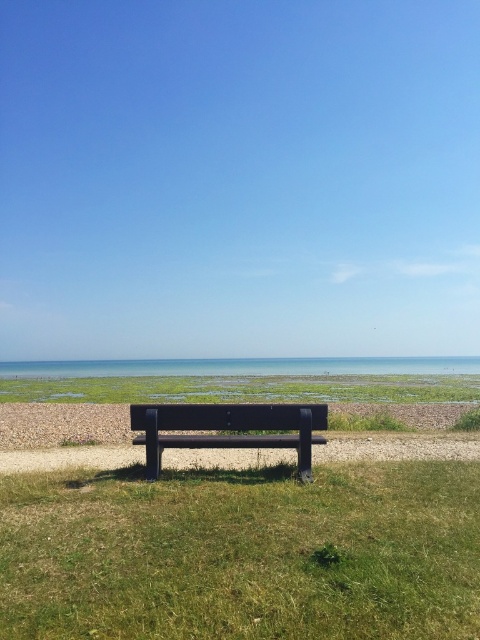
Which of these two, green grass at center or blue water at center, stands shorter?

green grass at center is shorter.

Is point (336, 538) closer to viewer compared to point (139, 362)?

Yes, point (336, 538) is in front of point (139, 362).

At what (x,y) coordinates should I click in order to perform the action: click on green grass at center. Please return your answer as a coordinate pair (x, y). Looking at the image, I should click on (242, 554).

Who is more distant from viewer, (326, 426) or (352, 374)?

The point (352, 374) is more distant.

Is point (280, 406) farther from camera compared to point (8, 365)?

No, (280, 406) is in front of (8, 365).

You are a GUI agent. You are given a task and a screenshot of the screen. Output one action in this format:
    pyautogui.click(x=<x>, y=<y>)
    Task: Click on the matte black bench at center
    The height and width of the screenshot is (640, 480).
    Given the screenshot: What is the action you would take?
    pyautogui.click(x=228, y=428)

Which is above, green grass at center or matte black bench at center?

green grass at center is higher up.

In the scene shown: Can you confirm if green grass at center is positioned to the right of matte black bench at center?

Incorrect, green grass at center is not on the right side of matte black bench at center.

Is point (162, 618) positioned behind point (159, 452)?

No.

Locate an element on the screen. green grass at center is located at coordinates (242, 554).